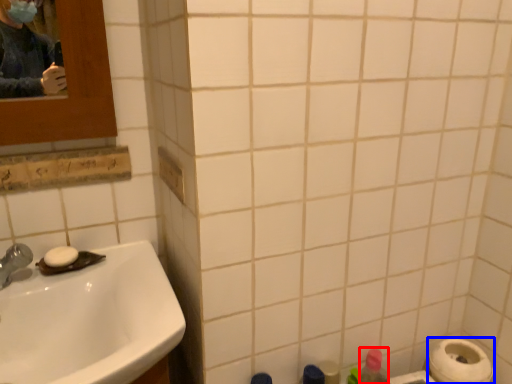
Question: Which of the following is the farthest to the observer, cleaning product (highlighted by a red box) or toilet paper (highlighted by a blue box)?

Choices:
 (A) cleaning product
 (B) toilet paper

Answer: (A)